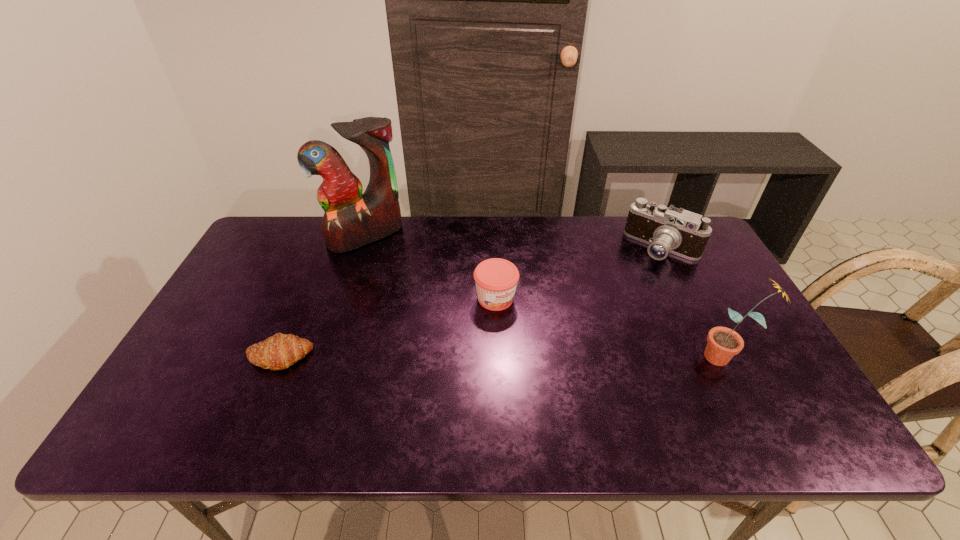
Identify the location of the shortest object. The height and width of the screenshot is (540, 960). (278, 352).

Locate an element on the screen. The width and height of the screenshot is (960, 540). the fourth shortest object is located at coordinates coord(723,343).

Identify the location of the tallest object. Image resolution: width=960 pixels, height=540 pixels. (351, 220).

Where is `camera`? Image resolution: width=960 pixels, height=540 pixels. camera is located at coordinates (666, 230).

Locate an element on the screen. The image size is (960, 540). the third farthest object is located at coordinates (496, 279).

Locate an element on the screen. This screenshot has height=540, width=960. the second shortest object is located at coordinates (496, 279).

The height and width of the screenshot is (540, 960). I want to click on vacant space located 0.110m on the right of the crescent roll, so click(x=355, y=357).

Find the location of `free spot located 0.320m on the flower of the sunflower`. free spot located 0.320m on the flower of the sunflower is located at coordinates (572, 356).

Locate an element on the screen. This screenshot has width=960, height=540. free space located 0.340m on the flower of the sunflower is located at coordinates (564, 356).

Locate an element on the screen. The height and width of the screenshot is (540, 960). blank space located 0.050m on the flower of the sunflower is located at coordinates (681, 356).